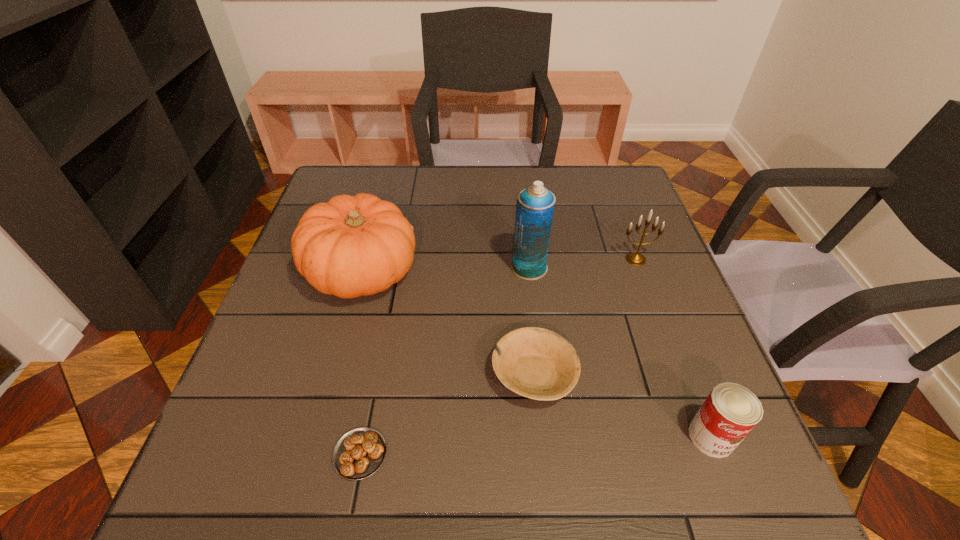
Find the location of `vacant region located on the front label of the can`. vacant region located on the front label of the can is located at coordinates (732, 489).

At what (x,y) coordinates should I click in order to perform the action: click on free point located on the left of the bowl. Please return your answer as a coordinate pair (x, y). Looking at the image, I should click on (461, 375).

The width and height of the screenshot is (960, 540). I want to click on vacant space situated on the right of the shortest object, so click(x=568, y=454).

At what (x,y) coordinates should I click in order to perform the action: click on can that is positioned at the near edge. Please return your answer as a coordinate pair (x, y). The height and width of the screenshot is (540, 960). Looking at the image, I should click on (730, 412).

Where is `pastry located at the near edge`? This screenshot has height=540, width=960. pastry located at the near edge is located at coordinates (359, 453).

This screenshot has height=540, width=960. Identify the location of object that is at the left edge. (351, 246).

Find the location of `candelabrum located in the right edge section of the desktop`. candelabrum located in the right edge section of the desktop is located at coordinates (635, 258).

In order to click on can at the right edge in this screenshot , I will do `click(730, 412)`.

Find the location of a particular element. object positioned at the near right corner is located at coordinates (730, 412).

In the image, there is a desktop. At what (x,y) coordinates should I click in order to perform the action: click on free space at the far edge. Please return your answer as a coordinate pair (x, y). The image size is (960, 540). Looking at the image, I should click on (497, 207).